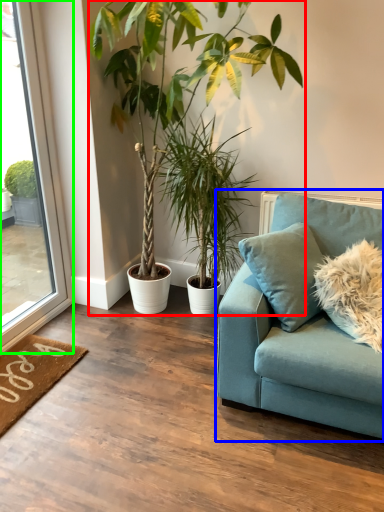
Question: Considering the real-world distances, which object is closest to houseplant (highlighted by a red box)? studio couch (highlighted by a blue box) or window (highlighted by a green box).

Choices:
 (A) studio couch
 (B) window

Answer: (B)